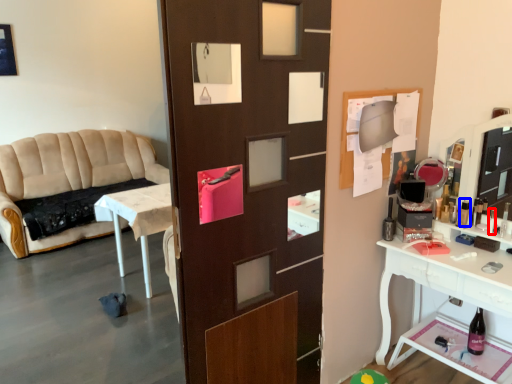
Question: Which object appears farthest to the camera in this image, toiletry (highlighted by a red box) or toiletry (highlighted by a blue box)?

Choices:
 (A) toiletry
 (B) toiletry

Answer: (B)